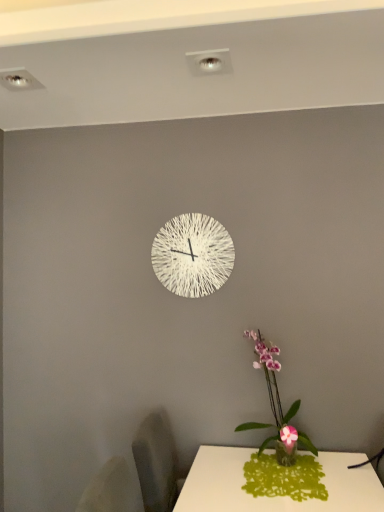
Question: Considering the positions of point (291, 426) and point (155, 262), is point (291, 426) closer or farther from the camera than point (155, 262)?

Choices:
 (A) farther
 (B) closer

Answer: (B)

Question: From the image's perspective, is pink orchid at lower right above or below white textured clock at center?

Choices:
 (A) below
 (B) above

Answer: (A)

Question: Considering the positions of pink orchid at lower right and white textured clock at center in the image, is pink orchid at lower right wider or thinner than white textured clock at center?

Choices:
 (A) thin
 (B) wide

Answer: (B)

Question: From the image's perspective, relative to pink orchid at lower right, is white textured clock at center above or below?

Choices:
 (A) below
 (B) above

Answer: (B)

Question: In terms of height, does white textured clock at center look taller or shorter compared to pink orchid at lower right?

Choices:
 (A) tall
 (B) short

Answer: (B)

Question: Which is correct: white textured clock at center is inside pink orchid at lower right, or outside of it?

Choices:
 (A) inside
 (B) outside

Answer: (B)

Question: Looking at the image, does white textured clock at center seem bigger or smaller compared to pink orchid at lower right?

Choices:
 (A) small
 (B) big

Answer: (A)